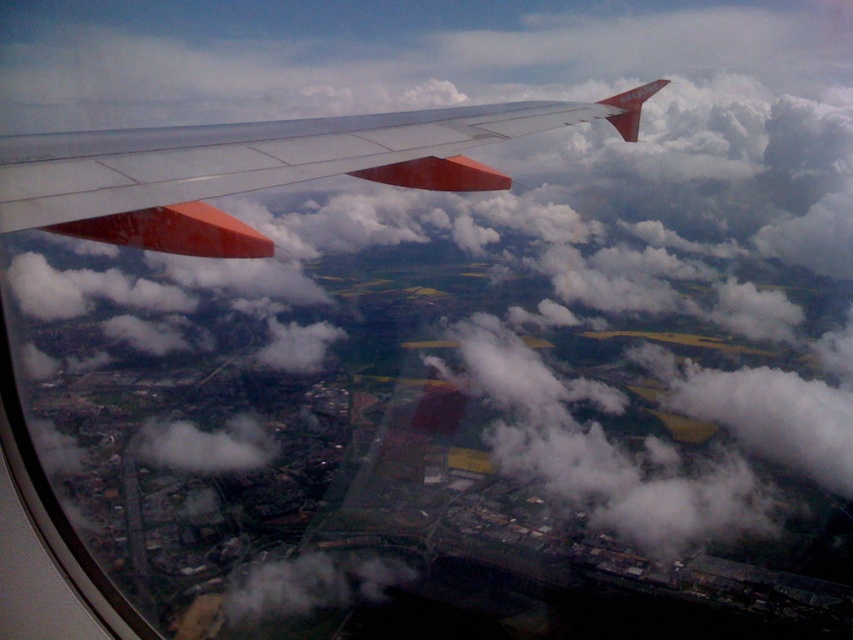
Question: Can you confirm if matte white wing at upper left is bigger than white fluffy cloud at lower center?

Choices:
 (A) yes
 (B) no

Answer: (B)

Question: Which point is farther to the camera?

Choices:
 (A) (200, 435)
 (B) (91, 150)

Answer: (A)

Question: Which object appears farthest from the camera in this image?

Choices:
 (A) white fluffy cloud at lower center
 (B) matte white wing at upper left
 (C) white fluffy cloud at lower left

Answer: (C)

Question: Is white fluffy cloud at lower center further to camera compared to white fluffy cloud at lower left?

Choices:
 (A) yes
 (B) no

Answer: (B)

Question: Which of these objects is positioned farthest from the white fluffy cloud at lower left?

Choices:
 (A) matte white wing at upper left
 (B) white fluffy cloud at lower center

Answer: (A)

Question: Does matte white wing at upper left appear over white fluffy cloud at lower center?

Choices:
 (A) yes
 (B) no

Answer: (A)